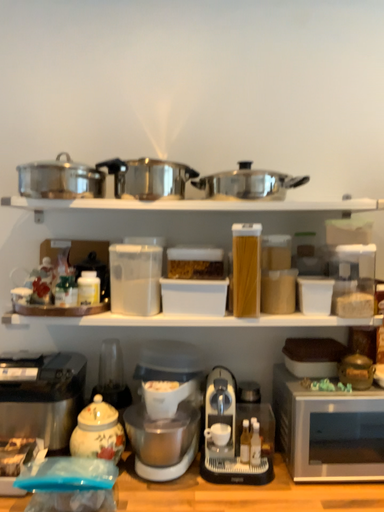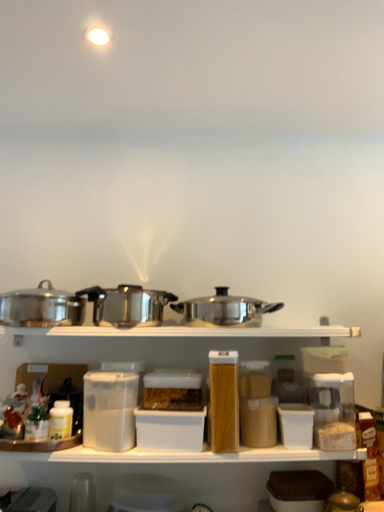
Question: How did the camera likely rotate when shooting the video?

Choices:
 (A) rotated upward
 (B) rotated downward

Answer: (A)